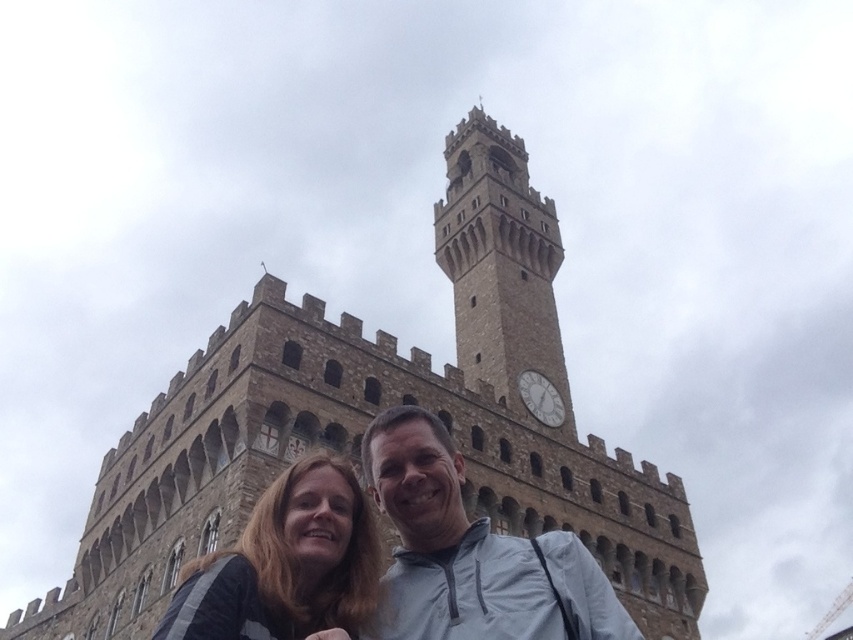
Can you confirm if matte gray jacket at center is positioned to the right of stone clock tower at center?

Incorrect, matte gray jacket at center is not on the right side of stone clock tower at center.

This screenshot has height=640, width=853. I want to click on matte gray jacket at center, so click(468, 554).

Between point (518, 586) and point (506, 371), which one is positioned in front?

Point (518, 586)

Find the location of a particular element. matte gray jacket at center is located at coordinates (468, 554).

Between brown stone tower at center and stone clock tower at center, which one has more height?

brown stone tower at center is taller.

Is brown stone tower at center positioned before stone clock tower at center?

Yes, brown stone tower at center is closer to the viewer.

At what (x,y) coordinates should I click in order to perform the action: click on brown stone tower at center. Please return your answer as a coordinate pair (x, y). The height and width of the screenshot is (640, 853). Looking at the image, I should click on (370, 417).

Locate an element on the screen. This screenshot has width=853, height=640. brown stone tower at center is located at coordinates (370, 417).

Which is behind, point (331, 634) or point (276, 508)?

Positioned behind is point (276, 508).

Measure the distance between point (460, 598) and camera.

Point (460, 598) is 22.03 meters from camera.

Which is in front, point (498, 576) or point (358, 547)?

Point (498, 576) is more forward.

At what (x,y) coordinates should I click in order to perform the action: click on matte gray jacket at center. Please return your answer as a coordinate pair (x, y). Looking at the image, I should click on (468, 554).